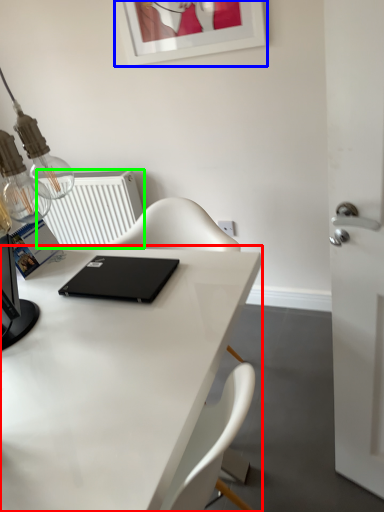
Question: Considering the real-world distances, which object is farthest from desk (highlighted by a red box)? picture frame (highlighted by a blue box) or radiator (highlighted by a green box)?

Choices:
 (A) picture frame
 (B) radiator

Answer: (A)